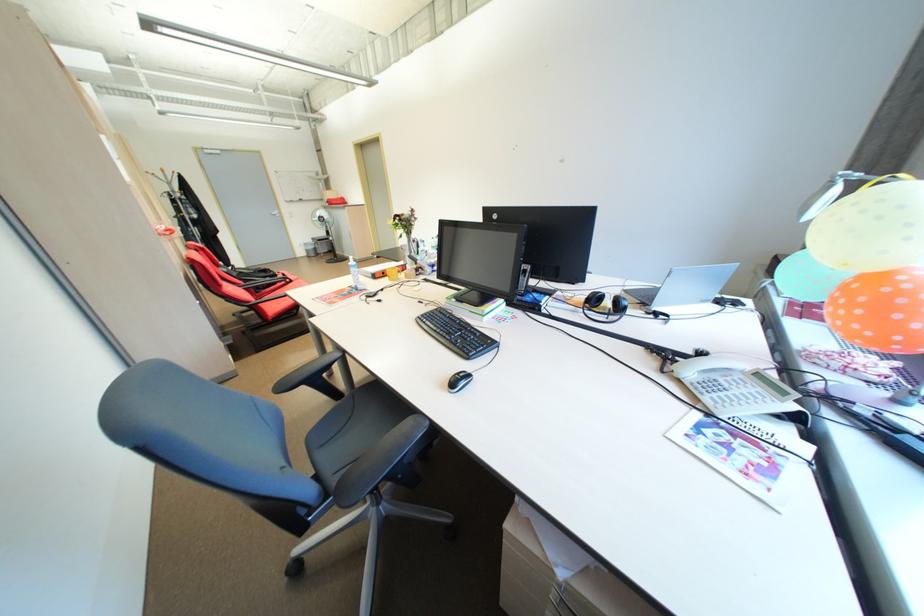
Which object does [354,270] point to?

It refers to a plastic water bottle.